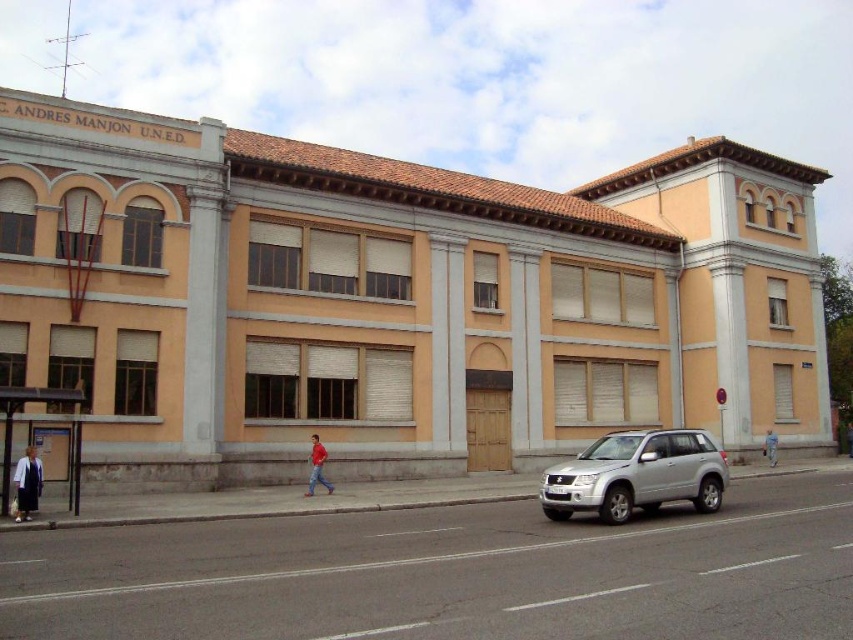
Question: Is white fabric coat at lower left above light blue denim jacket at center?

Choices:
 (A) no
 (B) yes

Answer: (B)

Question: Can you confirm if white fabric coat at lower left is positioned to the left of light blue denim jacket at center?

Choices:
 (A) no
 (B) yes

Answer: (B)

Question: Among these objects, which one is farthest from the camera?

Choices:
 (A) white fabric coat at lower left
 (B) light blue denim jacket at center
 (C) red cotton shirt at center

Answer: (B)

Question: Is red cotton shirt at center to the left of light blue denim jacket at center from the viewer's perspective?

Choices:
 (A) no
 (B) yes

Answer: (B)

Question: Which point is closer to the camera taking this photo?

Choices:
 (A) (329, 492)
 (B) (16, 492)
 (C) (601, 467)
 (D) (769, 465)

Answer: (C)

Question: Which object is the closest to the silver metallic suv at lower right?

Choices:
 (A) red cotton shirt at center
 (B) light blue denim jacket at center
 (C) white fabric coat at lower left

Answer: (A)